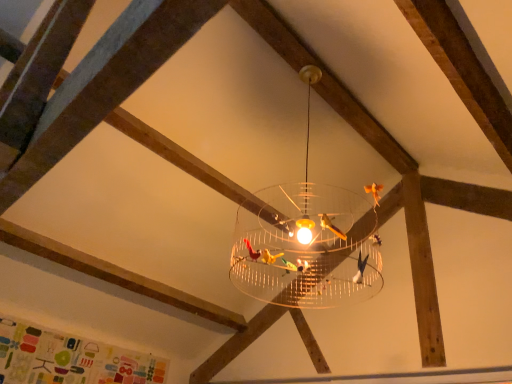
Measure the distance between point (316, 276) and camera.

The distance of point (316, 276) from camera is 2.21 meters.

Locate an element on the screen. clear glass chandelier at center is located at coordinates (307, 241).

The height and width of the screenshot is (384, 512). What do you see at coordinates (307, 241) in the screenshot?
I see `clear glass chandelier at center` at bounding box center [307, 241].

At what (x,y) coordinates should I click in order to perform the action: click on clear glass chandelier at center. Please return your answer as a coordinate pair (x, y). This screenshot has width=512, height=384. Looking at the image, I should click on (307, 241).